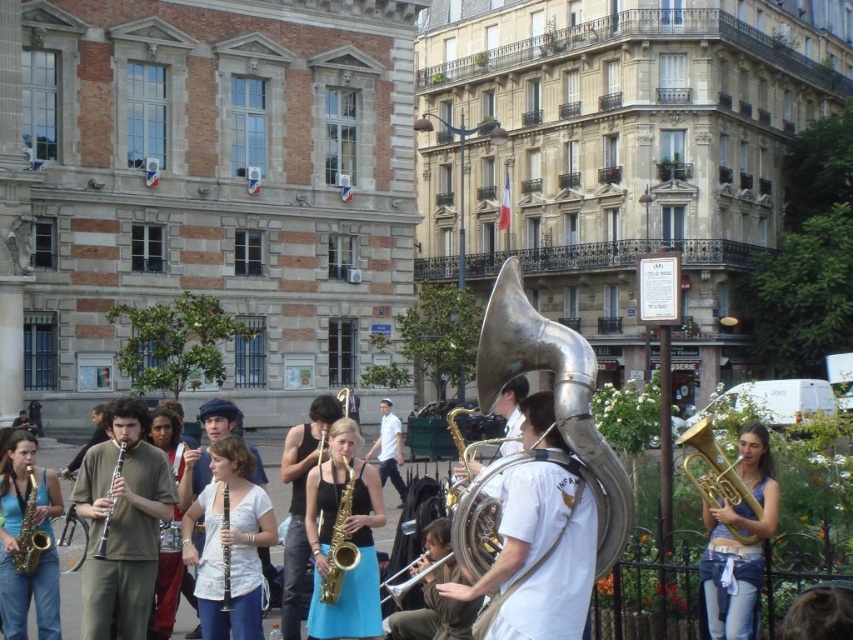
Which is more to the left, white matte shirt at center or gold saxophone at lower left?

Positioned to the left is gold saxophone at lower left.

Which is more to the right, white matte shirt at center or gold saxophone at lower left?

Positioned to the right is white matte shirt at center.

Describe the element at coordinates (387, 449) in the screenshot. The width and height of the screenshot is (853, 640). I see `white matte shirt at center` at that location.

You are a GUI agent. You are given a task and a screenshot of the screen. Output one action in this format:
    pyautogui.click(x=<x>, y=<y>)
    Task: Click on the white matte shirt at center
    This screenshot has width=853, height=640.
    Given the screenshot: What is the action you would take?
    pyautogui.click(x=387, y=449)

Between point (149, 509) and point (393, 589), which one is positioned behind?

Positioned behind is point (149, 509).

Which is more to the right, matte green clarinet at center or silver metallic trumpet at center?

Positioned to the right is silver metallic trumpet at center.

Find the location of a particular element. Image resolution: width=853 pixels, height=640 pixels. matte green clarinet at center is located at coordinates (122, 524).

Can you confirm if matte green clarinet at center is bigger than white matte shirt at center?

No, matte green clarinet at center is not bigger than white matte shirt at center.

Does matte green clarinet at center have a smaller size compared to white matte shirt at center?

Yes, matte green clarinet at center is smaller than white matte shirt at center.

Image resolution: width=853 pixels, height=640 pixels. What do you see at coordinates (122, 524) in the screenshot? I see `matte green clarinet at center` at bounding box center [122, 524].

Where is `matte green clarinet at center`? The width and height of the screenshot is (853, 640). matte green clarinet at center is located at coordinates (122, 524).